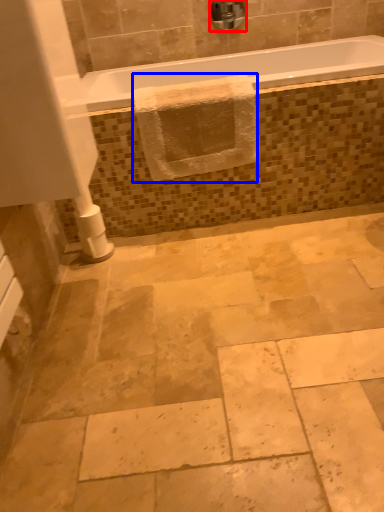
Question: Which object is closer to the camera taking this photo, faucet (highlighted by a red box) or bath towel (highlighted by a blue box)?

Choices:
 (A) faucet
 (B) bath towel

Answer: (B)